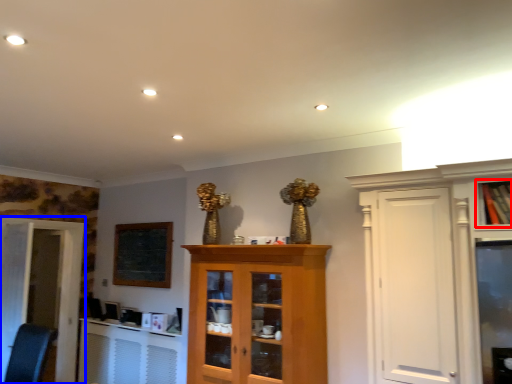
Question: Which point is further to the camera, cabinetry (highlighted by a red box) or door (highlighted by a blue box)?

Choices:
 (A) cabinetry
 (B) door

Answer: (B)